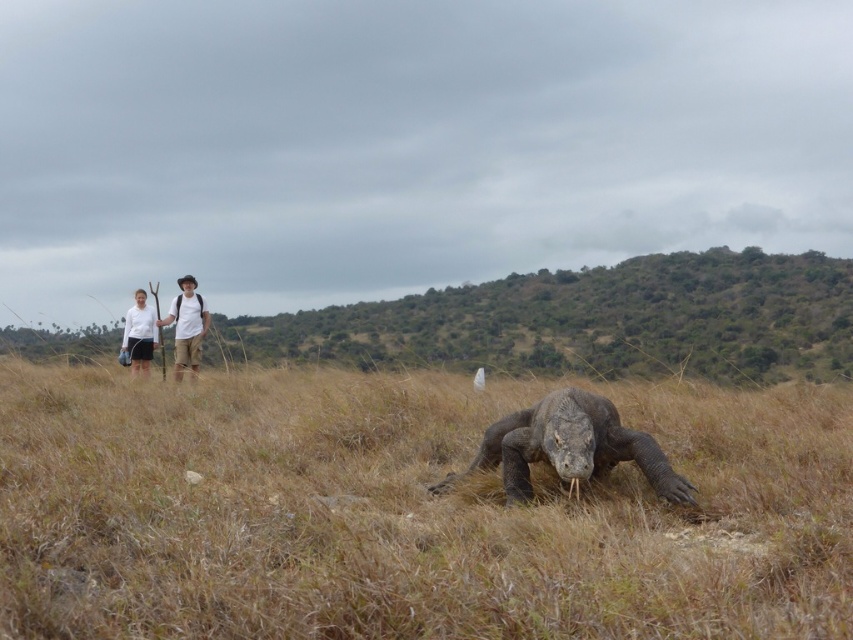
Which is behind, point (204, 308) or point (148, 358)?

Point (148, 358)

Which of these two, white cotton shirt at center or white matte shirt at left, stands taller?

white cotton shirt at center is taller.

Which is behind, point (196, 340) or point (131, 348)?

Point (131, 348)

Locate an element on the screen. white cotton shirt at center is located at coordinates (186, 326).

Based on the photo, can you confirm if gray rough skin at center is positioned to the left of white cotton shirt at center?

Incorrect, gray rough skin at center is not on the left side of white cotton shirt at center.

Is gray rough skin at center below white cotton shirt at center?

Yes, gray rough skin at center is below white cotton shirt at center.

Is point (654, 448) positioned behind point (196, 358)?

No.

Identify the location of gray rough skin at center. This screenshot has width=853, height=640. (569, 445).

Who is positioned more to the left, gray rough skin at center or white matte shirt at left?

A: Positioned to the left is white matte shirt at left.

Between point (636, 464) and point (132, 320), which one is positioned behind?

Positioned behind is point (132, 320).

Is point (666, 492) less distant than point (138, 305)?

Yes, point (666, 492) is closer to viewer.

Locate an element on the screen. Image resolution: width=853 pixels, height=640 pixels. gray rough skin at center is located at coordinates (569, 445).